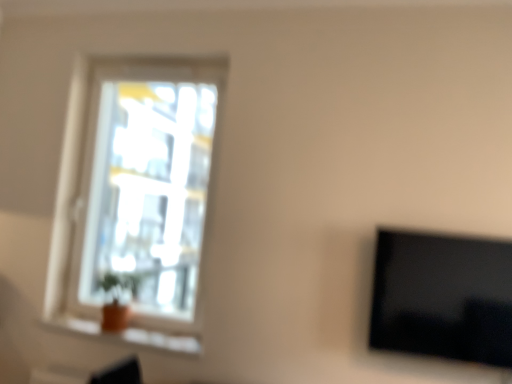
Question: Considering the relative sizes of transparent glass window at upper left and black glossy tv at right in the image provided, is transparent glass window at upper left shorter than black glossy tv at right?

Choices:
 (A) yes
 (B) no

Answer: (B)

Question: Can you confirm if transparent glass window at upper left is positioned to the left of black glossy tv at right?

Choices:
 (A) yes
 (B) no

Answer: (A)

Question: Can you confirm if transparent glass window at upper left is bigger than black glossy tv at right?

Choices:
 (A) no
 (B) yes

Answer: (B)

Question: Is transparent glass window at upper left closer to the viewer compared to black glossy tv at right?

Choices:
 (A) no
 (B) yes

Answer: (A)

Question: From the image's perspective, is transparent glass window at upper left on top of black glossy tv at right?

Choices:
 (A) yes
 (B) no

Answer: (A)

Question: Do you think orange clay pot at lower left is within transparent glass window at upper left, or outside of it?

Choices:
 (A) inside
 (B) outside

Answer: (B)

Question: Is orange clay pot at lower left wider or thinner than transparent glass window at upper left?

Choices:
 (A) thin
 (B) wide

Answer: (A)

Question: From a real-world perspective, is orange clay pot at lower left physically located above or below transparent glass window at upper left?

Choices:
 (A) above
 (B) below

Answer: (B)

Question: Is orange clay pot at lower left taller or shorter than transparent glass window at upper left?

Choices:
 (A) tall
 (B) short

Answer: (B)

Question: Visually, is orange clay pot at lower left positioned to the left or to the right of black glossy tv at right?

Choices:
 (A) right
 (B) left

Answer: (B)

Question: In terms of width, does orange clay pot at lower left look wider or thinner when compared to black glossy tv at right?

Choices:
 (A) thin
 (B) wide

Answer: (B)

Question: Is orange clay pot at lower left inside the boundaries of black glossy tv at right, or outside?

Choices:
 (A) outside
 (B) inside

Answer: (A)

Question: Is point (193, 350) closer or farther from the camera than point (406, 332)?

Choices:
 (A) farther
 (B) closer

Answer: (A)

Question: In the image, is transparent glass window at upper left on the left side or the right side of black glossy tv at right?

Choices:
 (A) left
 (B) right

Answer: (A)

Question: Is point (151, 205) closer or farther from the camera than point (384, 321)?

Choices:
 (A) farther
 (B) closer

Answer: (A)